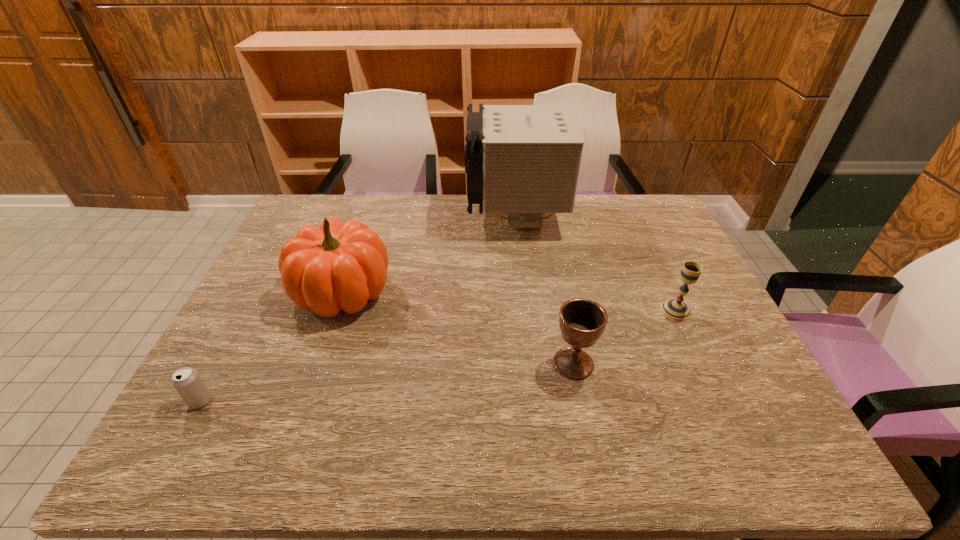
This screenshot has height=540, width=960. I want to click on free location at the near edge, so click(x=545, y=433).

In order to click on blank space at the left edge of the desktop in this screenshot , I will do `click(263, 297)`.

You are a GUI agent. You are given a task and a screenshot of the screen. Output one action in this format:
    pyautogui.click(x=<x>, y=<y>)
    Task: Click on the free location at the far left corner of the desktop
    
    Given the screenshot: What is the action you would take?
    pyautogui.click(x=316, y=208)

Locate an element on the screen. The image size is (960, 540). vacant space at the far right corner of the desktop is located at coordinates (632, 197).

Identify the location of free space that is in between the right chalice and the beer can. (438, 356).

Identify the location of free spot between the beer can and the rightmost object. The image size is (960, 540). (438, 356).

Locate an element on the screen. vacant area between the fan and the pumpkin is located at coordinates pyautogui.click(x=428, y=255).

This screenshot has height=540, width=960. Identify the location of free space between the fourth object from right to left and the nearer chalice. (458, 328).

Identify the location of vacant space that's between the beer can and the second object from left to right. This screenshot has height=540, width=960. (272, 347).

This screenshot has width=960, height=540. I want to click on empty space between the second tallest object and the leftmost object, so click(x=272, y=347).